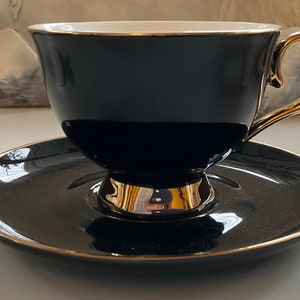
This screenshot has width=300, height=300. What are the coordinates of `china ware` in the screenshot? It's located at (163, 155).